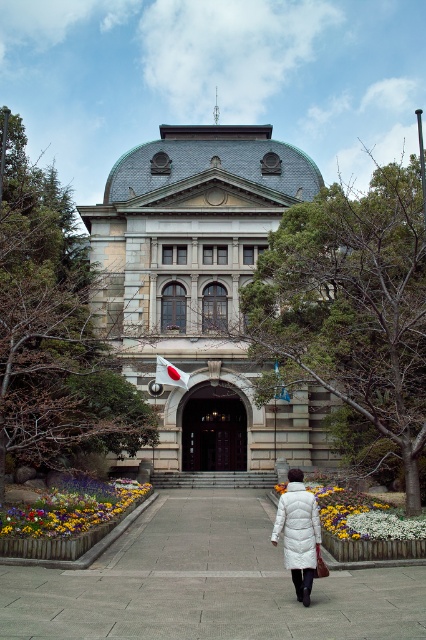
You are standing on the pathway in front of the classical building and see both the white down coat at center and the floral carpet at center. Which object is nearer to you?

The white down coat at center is closer to the viewer than the floral carpet at center, so the white down coat at center is nearer to you.

You are a window cleaner with a ladder that can reach up to 2 meters. You need to clean both the brown wooden door at center and the white fabric flag at center. Which object will require you to use the ladder?

The brown wooden door at center is taller than the white fabric flag at center, so you will need to use the ladder to clean the brown wooden door at center.

You are a gardener planning to water the floral carpet at center and the gray concrete pavement at center. Which one is on the left side?

The gray concrete pavement at center is positioned on the left side of the floral carpet at center.